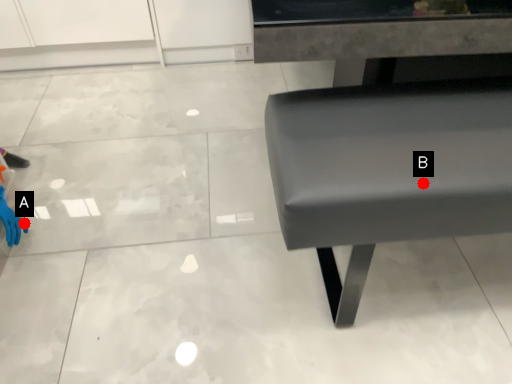
Question: Two points are circled on the image, labeled by A and B beside each circle. Among these points, which one is farthest from the camera?

Choices:
 (A) A is further
 (B) B is further

Answer: (A)